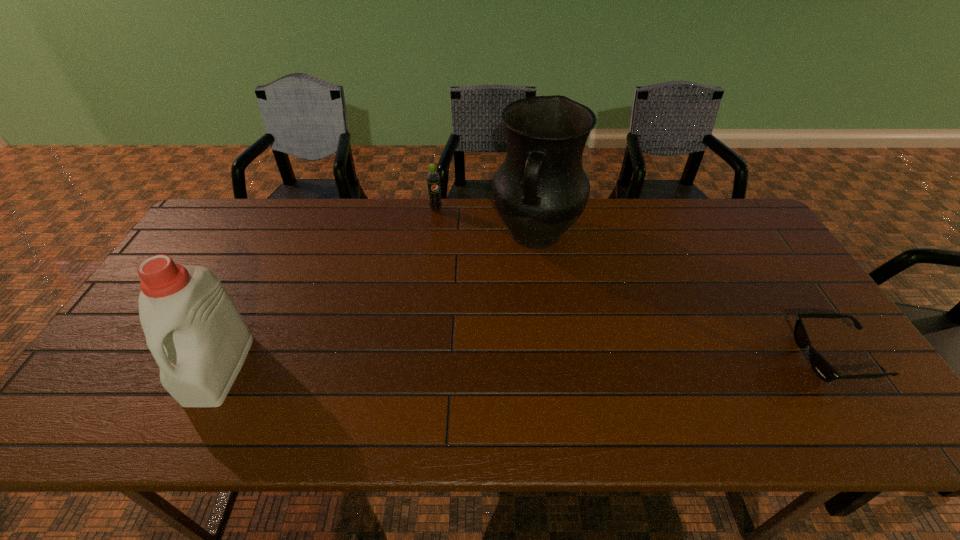
You are a GUI agent. You are given a task and a screenshot of the screen. Output one action in this format:
    pyautogui.click(x=<x>, y=<y>)
    Task: Click on the sunglasses present at the near edge
    The width and height of the screenshot is (960, 540).
    Given the screenshot: What is the action you would take?
    pyautogui.click(x=818, y=363)

The image size is (960, 540). Find the location of `object present at the right edge`. object present at the right edge is located at coordinates (818, 363).

Locate an element on the screen. The image size is (960, 540). object situated at the near right corner is located at coordinates (818, 363).

Where is `vacant space at the far edge of the desktop`? This screenshot has height=540, width=960. vacant space at the far edge of the desktop is located at coordinates (682, 214).

Where is `free point at the near edge`? The width and height of the screenshot is (960, 540). free point at the near edge is located at coordinates (529, 380).

At what (x,y) coordinates should I click in order to perform the action: click on vacant space at the right edge of the desktop. Please return your answer as a coordinate pair (x, y). The height and width of the screenshot is (540, 960). Looking at the image, I should click on (806, 312).

At what (x,y) coordinates should I click in order to perform the action: click on vacant space at the far left corner of the desktop. Please return your answer as a coordinate pair (x, y). The width and height of the screenshot is (960, 540). Looking at the image, I should click on (208, 230).

Find the location of a particular element. The width and height of the screenshot is (960, 540). vacant space at the near right corner of the desktop is located at coordinates (875, 394).

Where is `vacant region between the detergent and the second object from left to right`? Image resolution: width=960 pixels, height=540 pixels. vacant region between the detergent and the second object from left to right is located at coordinates (327, 289).

This screenshot has width=960, height=540. Identify the location of free area in between the rightmost object and the second tallest object. (527, 363).